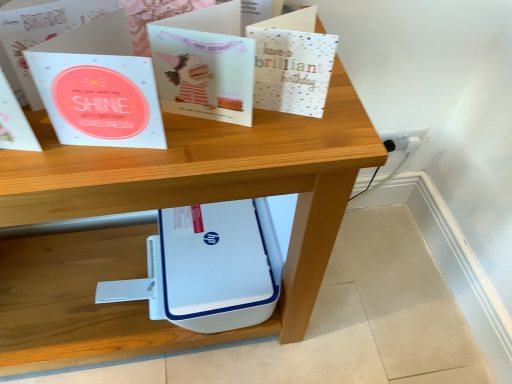
Question: Is white plastic socket at lower right wider or thinner than white plastic printer at center?

Choices:
 (A) wide
 (B) thin

Answer: (B)

Question: In the image, is white plastic socket at lower right positioned in front of or behind white plastic printer at center?

Choices:
 (A) behind
 (B) front

Answer: (A)

Question: Considering the real-world distances, which object is closest to the light blue paper at center, which is counted as the third paperback book, starting from the right?

Choices:
 (A) metallic silver card at upper center, which appears as the first paperback book when viewed from the right
 (B) matte paper card at center, acting as the second paperback book starting from the left
 (C) white plastic printer at center
 (D) white plastic socket at lower right

Answer: (B)

Question: Which object is the closest to the matte paper card at center, acting as the second paperback book starting from the left?

Choices:
 (A) white plastic socket at lower right
 (B) light blue paper at center, which is the 1th paperback book in left-to-right order
 (C) metallic silver card at upper center, which is the third paperback book in left-to-right order
 (D) white plastic printer at center

Answer: (C)